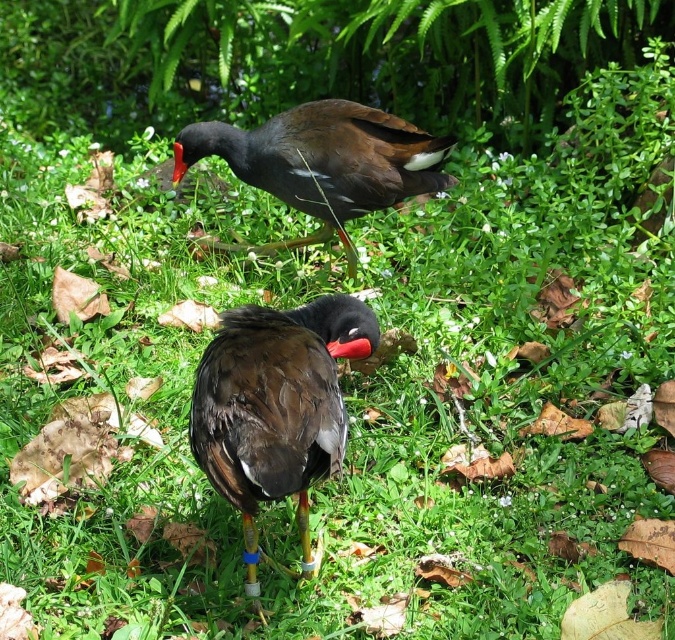
You are a photographer trying to capture both birds in a single shot. The first bird is at point (296, 452) and the second bird is at point (178, 157). Since you want to focus on the bird that is closer to you, which bird should you aim your camera at?

Point (296, 452) is closer to the viewer than point (178, 157), so you should aim your camera at the bird at point (296, 452) to focus on the closer one.

Consider the image. You are a photographer standing at point [217,476]. You want to take a photo of the two black birds with red beaks. To ensure both birds are in focus, what is the minimum distance you need to move backward from your current position?

The two birds are 1.67 meters apart. To ensure both are in focus, you need to move backward until the distance between you and the nearest bird is at least 1.67 meters divided by the hyperfocal distance of your camera lens. Without specific lens details, a general rule is to move back so the distance to the nearest bird is half the distance between the birds, so moving back approximately 0.84 meters.